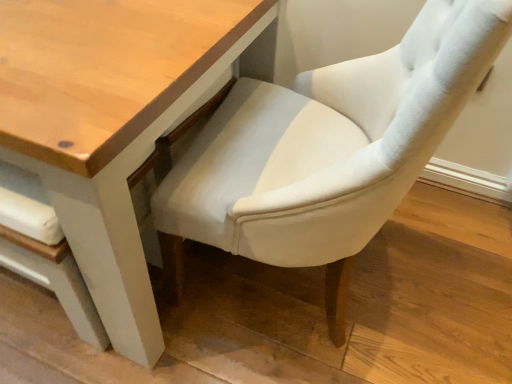
Identify the location of vacant space underneath light gray fabric chair at center (from a real-world perspective). The image size is (512, 384). (288, 292).